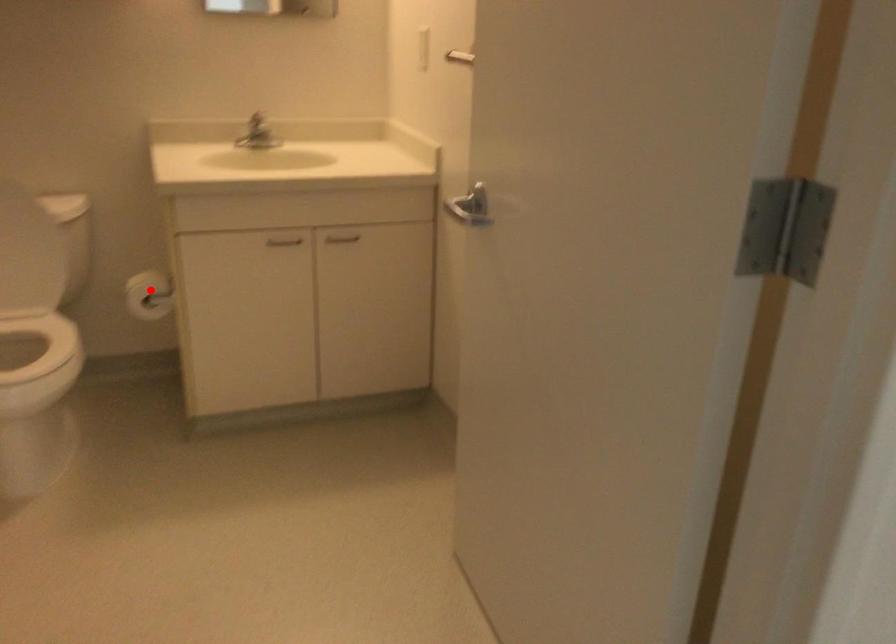
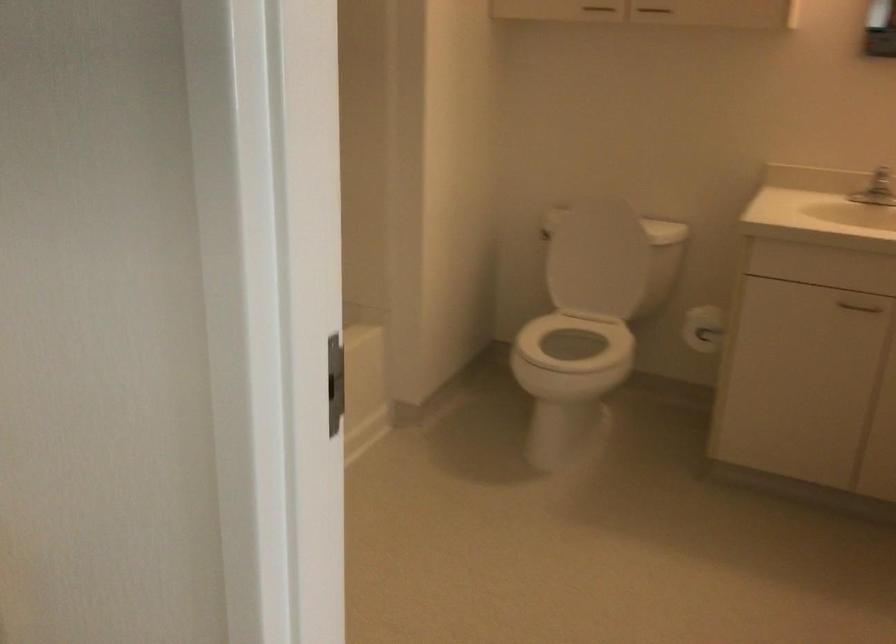
The point at the highlighted location is marked in the first image. Where is the corresponding point in the second image?

(702, 328)